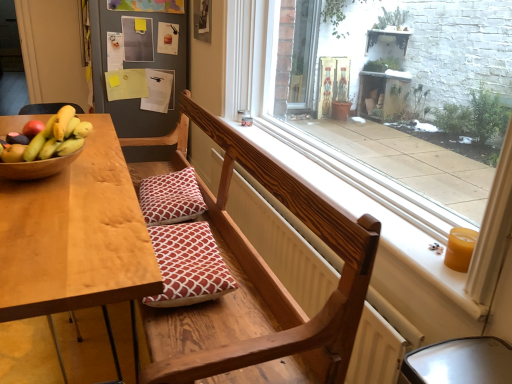
Where is `vacant space positioned to the left of yellow wax candle at right`? Image resolution: width=512 pixels, height=384 pixels. vacant space positioned to the left of yellow wax candle at right is located at coordinates (423, 253).